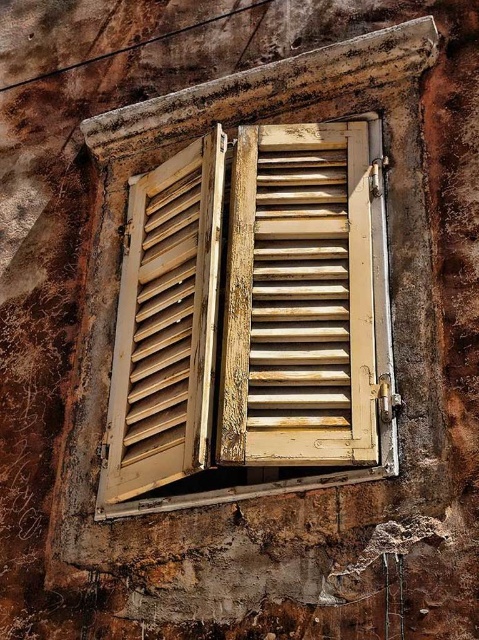
You are an interior designer assessing the wall with wooden shutters at center and wooden slats at center. Which object is closer to the viewer?

The wooden shutters at center are closer to the viewer than the wooden slats at center, which are positioned behind them.

You are standing directly in front of the wall with the weathered window. Where would you find the wooden shutters at center?

The wooden shutters at center are located at the 2D coordinates point (252,317) on the wall.